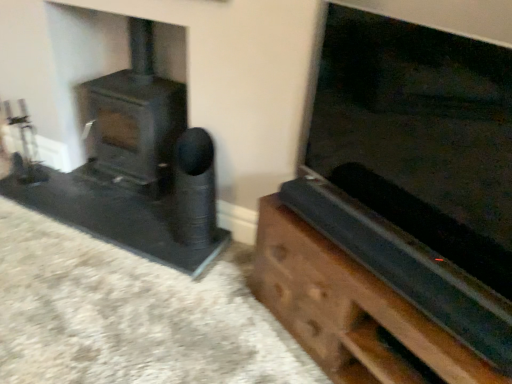
The height and width of the screenshot is (384, 512). What are the coordinates of `free space in front of black matte speaker at center` in the screenshot? It's located at (184, 259).